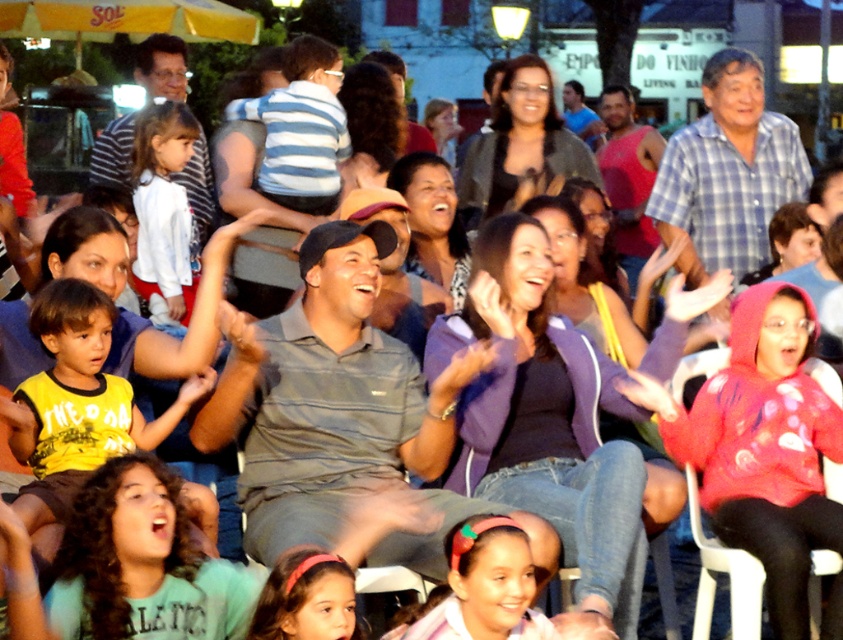
Question: From the image, what is the correct spatial relationship of white cotton shirt at upper left in relation to white plastic chair at lower right?

Choices:
 (A) right
 (B) left

Answer: (B)

Question: Which object is farther from the camera taking this photo?

Choices:
 (A) yellow matte shirt at lower left
 (B) white cotton shirt at upper left
 (C) white plastic chair at lower right

Answer: (B)

Question: Does yellow matte shirt at lower left have a lesser width compared to white cotton shirt at upper left?

Choices:
 (A) no
 (B) yes

Answer: (A)

Question: Considering the relative positions of white cotton shirt at upper left and white plastic chair at lower right in the image provided, where is white cotton shirt at upper left located with respect to white plastic chair at lower right?

Choices:
 (A) left
 (B) right

Answer: (A)

Question: Which point is closer to the camera?

Choices:
 (A) white cotton shirt at upper left
 (B) yellow matte shirt at lower left
 (C) white plastic chair at lower right

Answer: (B)

Question: Which point is closer to the camera?

Choices:
 (A) white cotton shirt at upper left
 (B) yellow matte shirt at lower left
 (C) white plastic chair at lower right

Answer: (B)